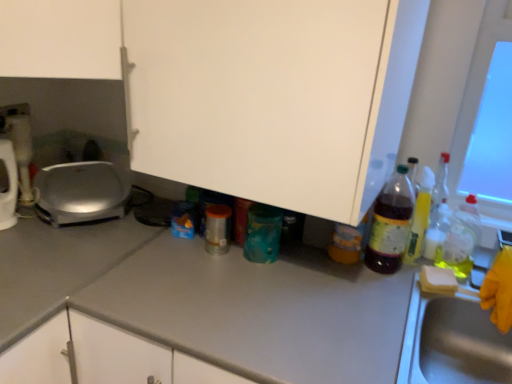
Identify the location of space that is in front of translucent plastic bottle at right, positioned as the fourth bottle in left-to-right order. (408, 285).